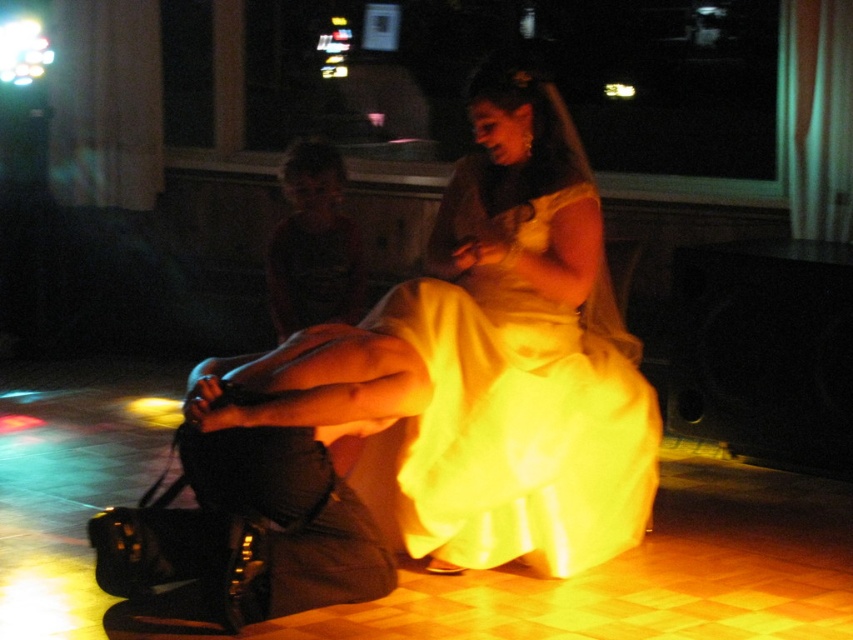
Question: Considering the relative positions of silky yellow dress at center and black leather purse at lower left in the image provided, where is silky yellow dress at center located with respect to black leather purse at lower left?

Choices:
 (A) above
 (B) below

Answer: (A)

Question: In this image, where is silky yellow dress at center located relative to black leather purse at lower left?

Choices:
 (A) right
 (B) left

Answer: (A)

Question: Which object appears farthest from the camera in this image?

Choices:
 (A) silky yellow dress at center
 (B) black leather purse at lower left

Answer: (A)

Question: Does silky yellow dress at center appear over black leather purse at lower left?

Choices:
 (A) yes
 (B) no

Answer: (A)

Question: Which object appears closest to the camera in this image?

Choices:
 (A) black leather purse at lower left
 (B) silky yellow dress at center

Answer: (A)